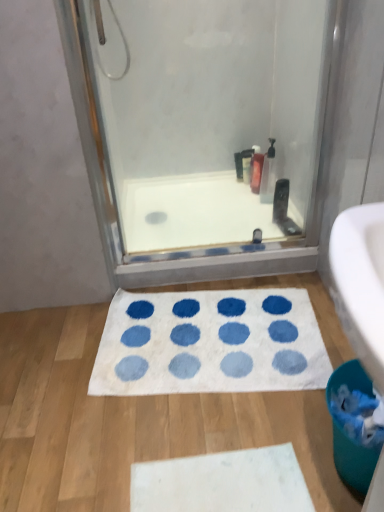
Where is `free space that is to the left of teal plastic toilet bowl at lower right`? free space that is to the left of teal plastic toilet bowl at lower right is located at coordinates (283, 458).